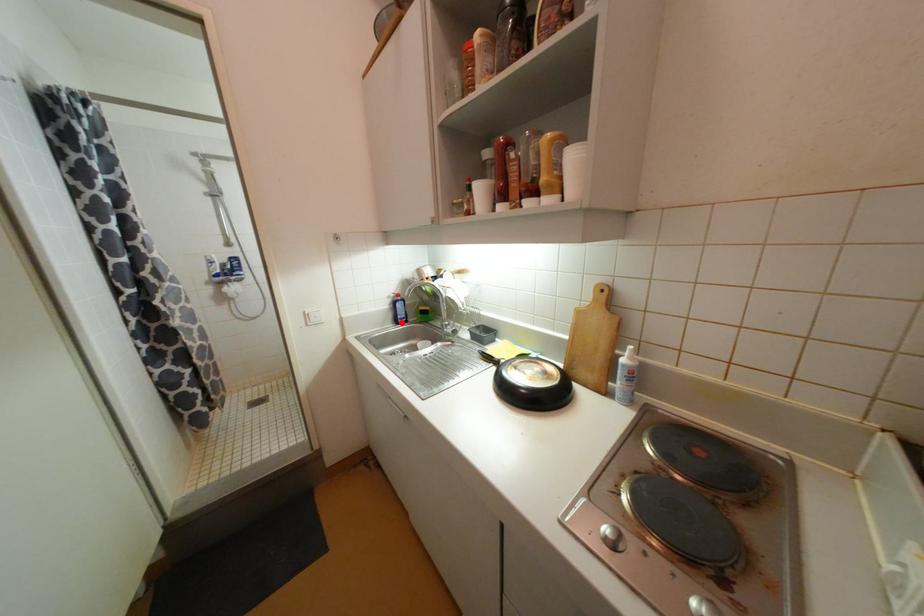
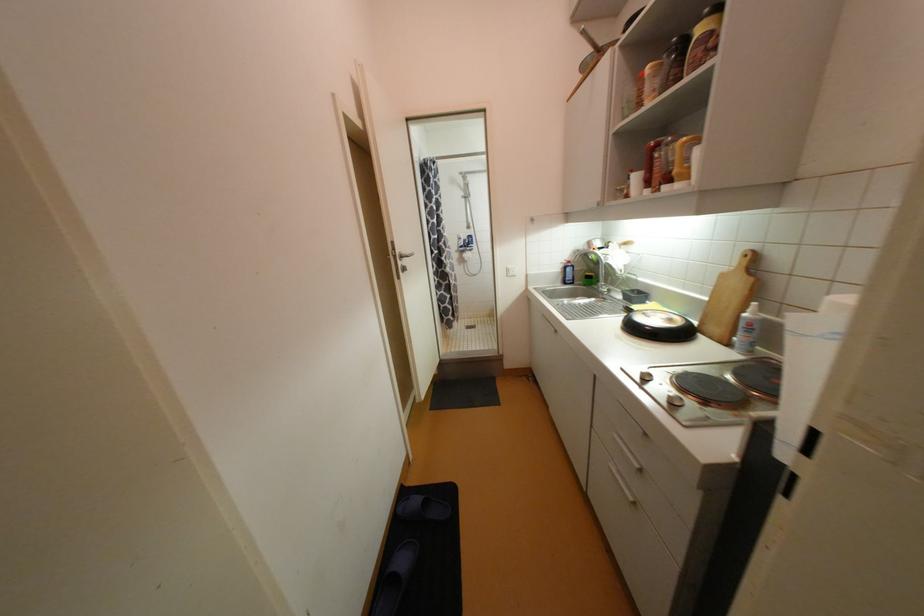
Where in the second image is the point corresponding to the highlighted location from the first image?

(569, 283)